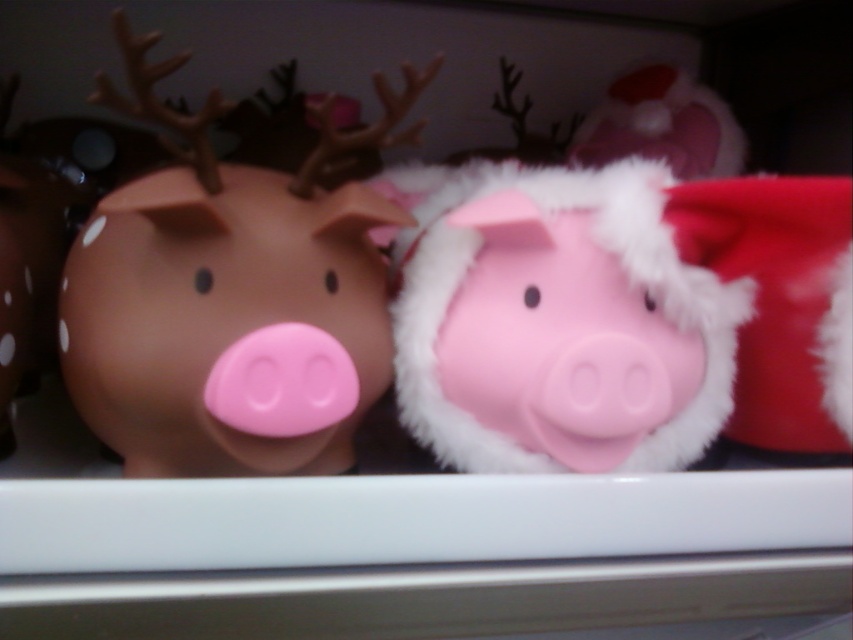
You are standing in front of a shelf with two piggy banks. You see a point marked at coordinates (230, 296). Which piggy bank is this point located on?

The point at coordinates (230, 296) is located on the brown matte piggy bank at left.

You are organizing a shelf and need to know the arrangement of the pigs. Which pig is positioned higher on the shelf between the brown matte piggy bank at left and the fuzzy pink pig at center?

The brown matte piggy bank at left is positioned higher than the fuzzy pink pig at center on the shelf.

You are organizing a shelf and need to place a new item between the brown matte piggy bank at left and the fuzzy pink pig at center. The new item is 3 inches wide. Is there enough space between them to fit it without moving the existing pigs?

The distance between the brown matte piggy bank at left and the fuzzy pink pig at center is 4.03 inches. Since the new item is 3 inches wide, there is enough space to fit it between them without moving the existing pigs.